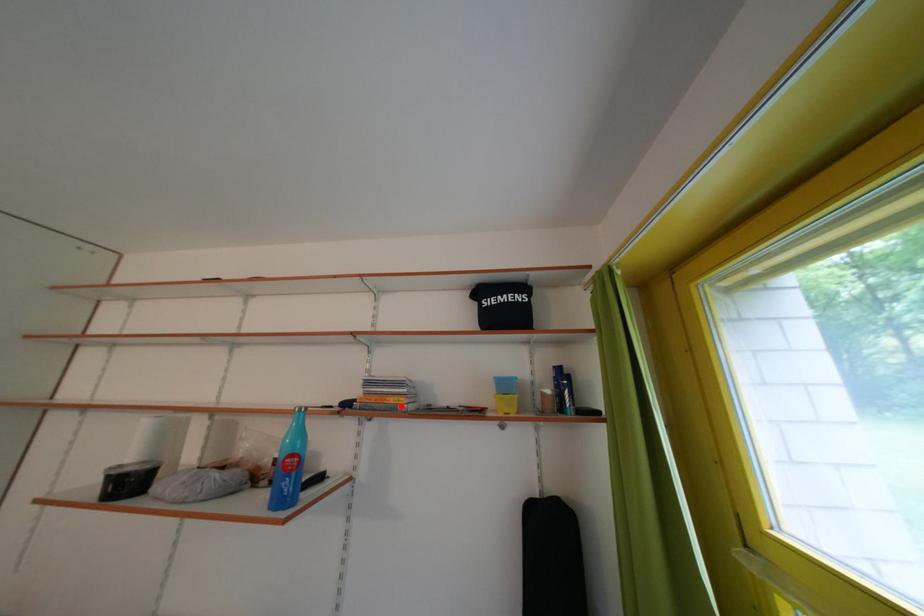
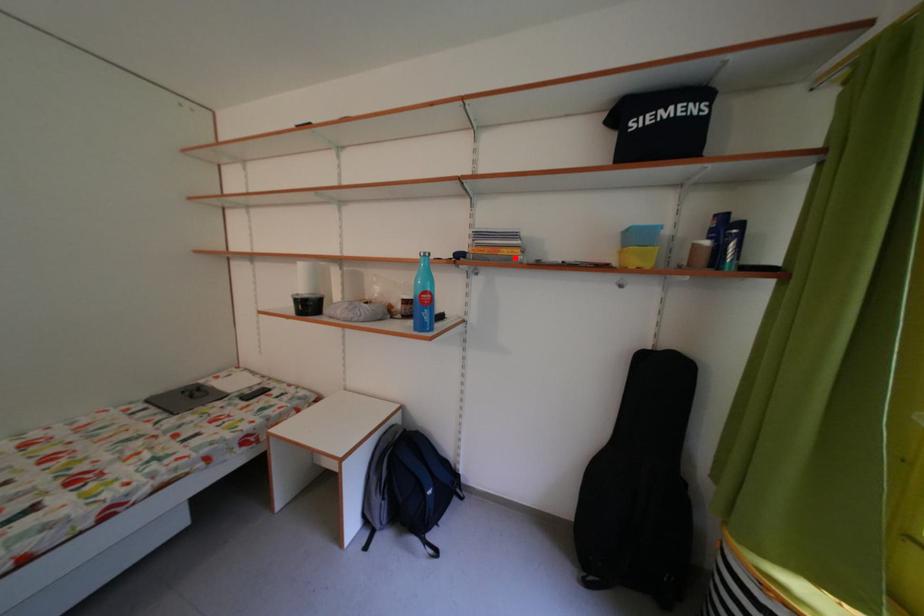
Consider the image. I am providing you with two images of the same scene from different viewpoints. A red point is marked on the first image and another point is marked on the second image. Are the points marked in image1 and image2 representing the same 3D position?

Yes